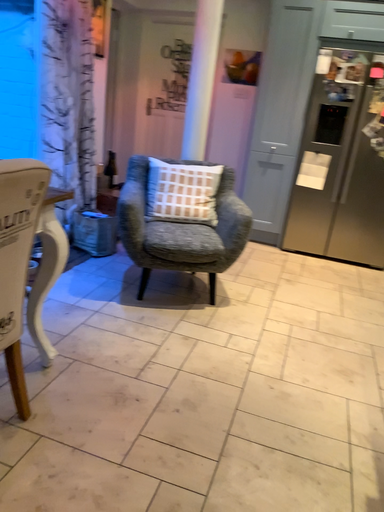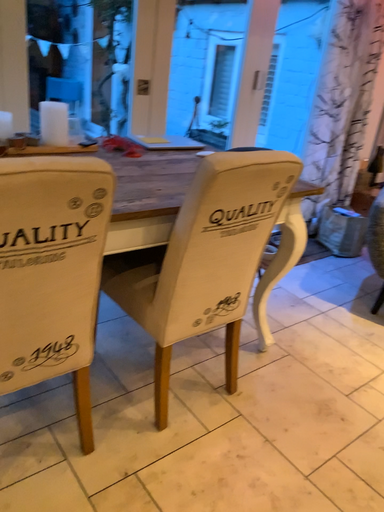
Question: Which way did the camera rotate in the video?

Choices:
 (A) rotated right
 (B) rotated left

Answer: (B)